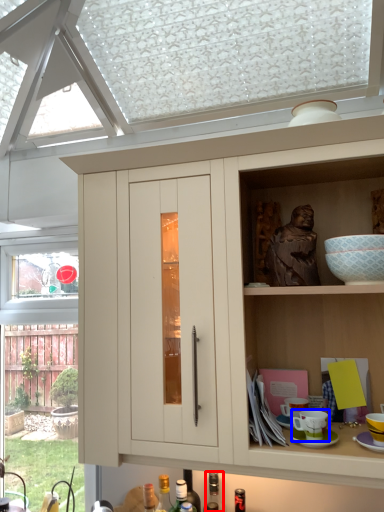
Question: Which point is closer to the camera, bottle (highlighted by a red box) or tableware (highlighted by a blue box)?

Choices:
 (A) bottle
 (B) tableware

Answer: (B)